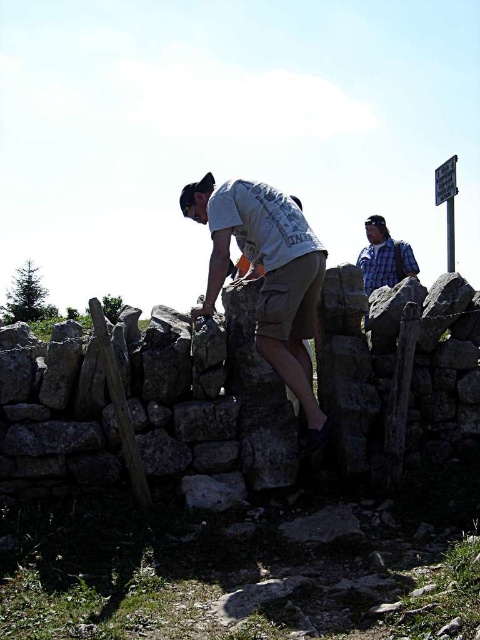
You are a photographer trying to capture both the light gray cotton shirt at center and the blue plaid shirt at upper right in a single frame. Since you want to ensure both are clearly visible, which shirt should you prioritize focusing on first due to its size?

The light gray cotton shirt at center should be prioritized first because it is larger in size compared to the blue plaid shirt at upper right, ensuring it is in focus before adjusting for the smaller one.

From the picture: You are standing at the origin point in the image. A light gray cotton shirt at center is located at coordinates 0.428, 0.556. If you need to move towards the shirt, in which direction should you move?

The light gray cotton shirt at center is located at coordinates (266, 273). Since the origin is at the bottom left corner, you should move towards the upper right direction to reach it.